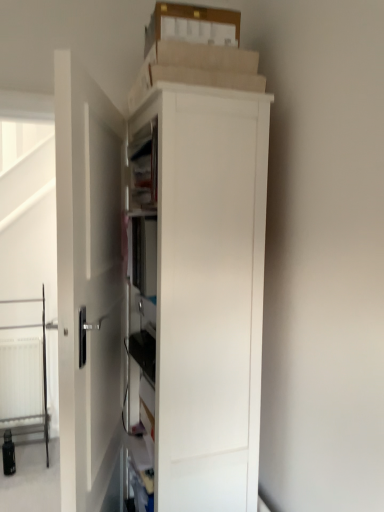
Question: Can you confirm if white matte cabinet at center is taller than white smooth door at center?

Choices:
 (A) yes
 (B) no

Answer: (B)

Question: From a real-world perspective, does white matte cabinet at center stand above white smooth door at center?

Choices:
 (A) yes
 (B) no

Answer: (A)

Question: Is white matte cabinet at center smaller than white smooth door at center?

Choices:
 (A) yes
 (B) no

Answer: (B)

Question: From the image's perspective, is white matte cabinet at center located beneath white smooth door at center?

Choices:
 (A) yes
 (B) no

Answer: (B)

Question: Is white matte cabinet at center turned away from white smooth door at center?

Choices:
 (A) no
 (B) yes

Answer: (B)

Question: Is white plastic radiator at lower left bigger or smaller than white smooth door at center?

Choices:
 (A) small
 (B) big

Answer: (A)

Question: From a real-world perspective, is white plastic radiator at lower left physically located above or below white smooth door at center?

Choices:
 (A) above
 (B) below

Answer: (B)

Question: From the image's perspective, is white plastic radiator at lower left located above or below white smooth door at center?

Choices:
 (A) above
 (B) below

Answer: (B)

Question: Is point (33, 372) closer or farther from the camera than point (96, 292)?

Choices:
 (A) closer
 (B) farther

Answer: (B)

Question: Is point tap(1, 358) closer or farther from the camera than point tap(11, 385)?

Choices:
 (A) closer
 (B) farther

Answer: (A)

Question: Would you say transparent glass screen door at left is to the left or to the right of white plastic radiator at lower left in the picture?

Choices:
 (A) left
 (B) right

Answer: (B)

Question: Is transparent glass screen door at left inside the boundaries of white plastic radiator at lower left, or outside?

Choices:
 (A) inside
 (B) outside

Answer: (B)

Question: Is transparent glass screen door at left bigger or smaller than white plastic radiator at lower left?

Choices:
 (A) small
 (B) big

Answer: (B)

Question: Considering the relative positions of transparent glass screen door at left and white smooth door at center in the image provided, is transparent glass screen door at left to the left or to the right of white smooth door at center?

Choices:
 (A) left
 (B) right

Answer: (A)

Question: Choose the correct answer: Is transparent glass screen door at left inside white smooth door at center or outside it?

Choices:
 (A) inside
 (B) outside

Answer: (B)